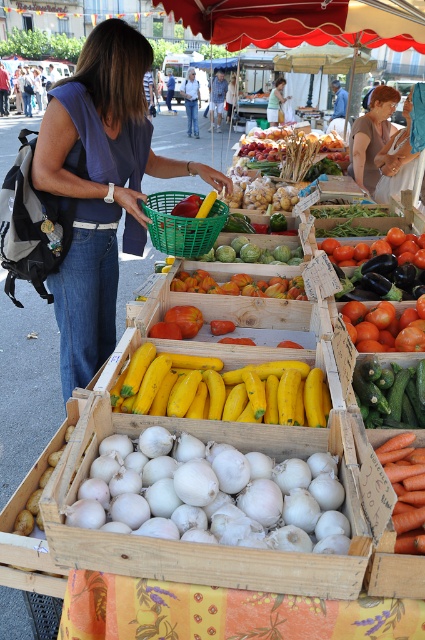
Is matte blue shirt at upper left taller than green woven basket at center?

Indeed, matte blue shirt at upper left has a greater height compared to green woven basket at center.

Between point (173, 168) and point (170, 236), which one is positioned behind?

Point (173, 168)

Image resolution: width=425 pixels, height=640 pixels. Identify the location of matte blue shirt at upper left. [x=101, y=186].

I want to click on matte blue shirt at upper left, so click(x=101, y=186).

Is yellow matte zucchini at center to the left of short red hair at upper center from the viewer's perspective?

Indeed, yellow matte zucchini at center is positioned on the left side of short red hair at upper center.

Based on the photo, does yellow matte zucchini at center have a greater width compared to short red hair at upper center?

Indeed, yellow matte zucchini at center has a greater width compared to short red hair at upper center.

Does point (149, 410) come in front of point (371, 164)?

Yes, point (149, 410) is closer to viewer.

Find the location of a particular element. This screenshot has width=425, height=640. yellow matte zucchini at center is located at coordinates (223, 388).

Between white smooth onions at center and yellow matte zucchini at center, which one is positioned lower?

white smooth onions at center

Which of these two, white smooth onions at center or yellow matte zucchini at center, stands shorter?

With less height is white smooth onions at center.

Image resolution: width=425 pixels, height=640 pixels. What do you see at coordinates (215, 497) in the screenshot?
I see `white smooth onions at center` at bounding box center [215, 497].

The width and height of the screenshot is (425, 640). What are the coordinates of `white smooth onions at center` in the screenshot? It's located at (215, 497).